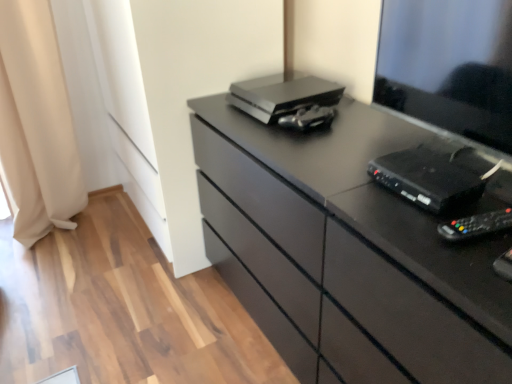
How much space does black plastic remote control at right, which is the 1th equipment from front to back, occupy horizontally?

black plastic remote control at right, which is the 1th equipment from front to back, is 7.65 inches in width.

What do you see at coordinates (282, 95) in the screenshot? This screenshot has height=384, width=512. I see `satin silver printer at upper center` at bounding box center [282, 95].

This screenshot has height=384, width=512. Describe the element at coordinates (449, 66) in the screenshot. I see `black plastic desktop at right` at that location.

Describe the element at coordinates (36, 123) in the screenshot. I see `beige fabric curtain at left` at that location.

Where is `matte black chest of drawers at center`? matte black chest of drawers at center is located at coordinates (346, 253).

The height and width of the screenshot is (384, 512). I want to click on black plastic remote control at right, acting as the 3th equipment starting from the back, so click(x=476, y=225).

Which of these two, satin silver printer at upper center or beige fabric curtain at left, is wider?

beige fabric curtain at left.

Consider the image. Considering the positions of objects satin silver printer at upper center and beige fabric curtain at left in the image provided, who is in front, satin silver printer at upper center or beige fabric curtain at left?

Positioned in front is satin silver printer at upper center.

Is point (324, 88) more distant than point (58, 151)?

No, it is in front of (58, 151).

Would you say beige fabric curtain at left is part of satin silver printer at upper center's contents?

No, satin silver printer at upper center does not contain beige fabric curtain at left.

Looking at this image, how much distance is there between black plastic desktop at right and beige fabric curtain at left?

1.62 meters.

Consider the image. Looking at the image, does black plastic desktop at right seem bigger or smaller compared to beige fabric curtain at left?

black plastic desktop at right is smaller than beige fabric curtain at left.

The width and height of the screenshot is (512, 384). I want to click on curtain behind the black plastic desktop at right, so click(36, 123).

Does black plastic desktop at right turn towards beige fabric curtain at left?

No, black plastic desktop at right is not turned towards beige fabric curtain at left.

Is metallic silver game controller at center, which ranks as the first equipment in back-to-front order, far from beige fabric curtain at left?

metallic silver game controller at center, which ranks as the first equipment in back-to-front order, is positioned a significant distance from beige fabric curtain at left.

How much distance is there between metallic silver game controller at center, placed as the first equipment when sorted from top to bottom, and beige fabric curtain at left?

metallic silver game controller at center, placed as the first equipment when sorted from top to bottom, and beige fabric curtain at left are 4.32 feet apart from each other.

Considering the sizes of metallic silver game controller at center, placed as the first equipment when sorted from top to bottom, and beige fabric curtain at left in the image, is metallic silver game controller at center, placed as the first equipment when sorted from top to bottom, bigger or smaller than beige fabric curtain at left?

In the image, metallic silver game controller at center, placed as the first equipment when sorted from top to bottom, appears to be smaller than beige fabric curtain at left.

From the picture: Is satin silver printer at upper center behind matte black chest of drawers at center?

Yes, satin silver printer at upper center is further from the camera.

From a real-world perspective, between satin silver printer at upper center and matte black chest of drawers at center, who is vertically lower?

matte black chest of drawers at center is physically lower.

Does satin silver printer at upper center turn towards matte black chest of drawers at center?

No, satin silver printer at upper center is not turned towards matte black chest of drawers at center.

Where is `equipment that is the 2nd object located above the black plastic remote control at right, the 3th equipment viewed from the top (from the image's perspective)`? The image size is (512, 384). equipment that is the 2nd object located above the black plastic remote control at right, the 3th equipment viewed from the top (from the image's perspective) is located at coordinates (308, 118).

From a real-world perspective, is metallic silver game controller at center, which is counted as the 3th equipment, starting from the bottom, above or below black plastic remote control at right, the 3th equipment viewed from the top?

metallic silver game controller at center, which is counted as the 3th equipment, starting from the bottom, is above black plastic remote control at right, the 3th equipment viewed from the top.

Is metallic silver game controller at center, which is counted as the 3th equipment, starting from the bottom, taller than black plastic remote control at right, the 3th equipment viewed from the top?

Indeed, metallic silver game controller at center, which is counted as the 3th equipment, starting from the bottom, has a greater height compared to black plastic remote control at right, the 3th equipment viewed from the top.

Between metallic silver game controller at center, placed as the first equipment when sorted from top to bottom, and black plastic remote control at right, the 3th equipment viewed from the top, which one has larger width?

With larger width is black plastic remote control at right, the 3th equipment viewed from the top.

Considering the sizes of objects beige fabric curtain at left and black plastic device at right, which ranks as the 2th equipment in front-to-back order, in the image provided, who is thinner, beige fabric curtain at left or black plastic device at right, which ranks as the 2th equipment in front-to-back order,?

Thinner between the two is black plastic device at right, which ranks as the 2th equipment in front-to-back order.

Considering the positions of objects beige fabric curtain at left and black plastic device at right, which is counted as the second equipment, starting from the back, in the image provided, who is more to the left, beige fabric curtain at left or black plastic device at right, which is counted as the second equipment, starting from the back,?

From the viewer's perspective, beige fabric curtain at left appears more on the left side.

Considering the positions of objects beige fabric curtain at left and black plastic device at right, which is counted as the second equipment, starting from the back, in the image provided, who is in front, beige fabric curtain at left or black plastic device at right, which is counted as the second equipment, starting from the back,?

black plastic device at right, which is counted as the second equipment, starting from the back, is in front.

Between black plastic desktop at right and satin silver printer at upper center, which one has more height?

Standing taller between the two is black plastic desktop at right.

Considering the relative sizes of black plastic desktop at right and satin silver printer at upper center in the image provided, is black plastic desktop at right wider than satin silver printer at upper center?

Incorrect, the width of black plastic desktop at right does not surpass that of satin silver printer at upper center.

From a real-world perspective, who is located higher, black plastic desktop at right or satin silver printer at upper center?

black plastic desktop at right is physically above.

Considering the relative positions of black plastic desktop at right and satin silver printer at upper center in the image provided, is black plastic desktop at right to the left or to the right of satin silver printer at upper center?

black plastic desktop at right is positioned on satin silver printer at upper center's right side.

At what (x,y) coordinates should I click in order to perform the action: click on printer that appears on the right of beige fabric curtain at left. Please return your answer as a coordinate pair (x, y). Looking at the image, I should click on (282, 95).

Identify the location of curtain above the black plastic desktop at right (from the image's perspective). (36, 123).

From the image, which object appears to be farther from black plastic desktop at right, black plastic device at right, which is counted as the second equipment, starting from the back, or metallic silver game controller at center, which is counted as the 3th equipment, starting from the bottom?

metallic silver game controller at center, which is counted as the 3th equipment, starting from the bottom.

Based on their spatial positions, is black plastic remote control at right, the 3th equipment viewed from the top, or satin silver printer at upper center closer to black plastic desktop at right?

Among the two, black plastic remote control at right, the 3th equipment viewed from the top, is located nearer to black plastic desktop at right.

Looking at the image, which one is located closer to metallic silver game controller at center, which is the 3th equipment in front-to-back order, black plastic device at right, which appears as the 2th equipment when ordered from the bottom, or black plastic remote control at right, which is the 1th equipment from front to back?

black plastic device at right, which appears as the 2th equipment when ordered from the bottom, is positioned closer to the anchor metallic silver game controller at center, which is the 3th equipment in front-to-back order.

Which object lies nearer to the anchor point black plastic device at right, which is counted as the second equipment, starting from the back, metallic silver game controller at center, placed as the first equipment when sorted from top to bottom, or black plastic desktop at right?

black plastic desktop at right is positioned closer to the anchor black plastic device at right, which is counted as the second equipment, starting from the back.

Estimate the real-world distances between objects in this image. Which object is closer to black plastic desktop at right, black plastic remote control at right, which is the first equipment from bottom to top, or matte black chest of drawers at center?

matte black chest of drawers at center is closer to black plastic desktop at right.

Based on their spatial positions, is black plastic remote control at right, which is the first equipment from bottom to top, or black plastic device at right, which is counted as the second equipment, starting from the back, closer to matte black chest of drawers at center?

black plastic device at right, which is counted as the second equipment, starting from the back, is closer to matte black chest of drawers at center.

Based on their spatial positions, is black plastic device at right, which is counted as the second equipment, starting from the back, or black plastic desktop at right closer to satin silver printer at upper center?

black plastic desktop at right is closer to satin silver printer at upper center.

Looking at the image, which one is located closer to black plastic remote control at right, acting as the 3th equipment starting from the back, matte black chest of drawers at center or metallic silver game controller at center, placed as the first equipment when sorted from top to bottom?

matte black chest of drawers at center.

Image resolution: width=512 pixels, height=384 pixels. What are the coordinates of `printer located between beige fabric curtain at left and black plastic device at right, which is counted as the second equipment, starting from the back, in the left-right direction` in the screenshot? It's located at (282, 95).

Locate an element on the screen. This screenshot has width=512, height=384. desktop positioned between matte black chest of drawers at center and metallic silver game controller at center, which ranks as the first equipment in back-to-front order, from near to far is located at coordinates (449, 66).

I want to click on printer between beige fabric curtain at left and black plastic remote control at right, acting as the 3th equipment starting from the back, in the horizontal direction, so click(282, 95).

Find the location of `printer located between beige fabric curtain at left and metallic silver game controller at center, which is counted as the 3th equipment, starting from the bottom, in the left-right direction`. printer located between beige fabric curtain at left and metallic silver game controller at center, which is counted as the 3th equipment, starting from the bottom, in the left-right direction is located at coordinates (282, 95).